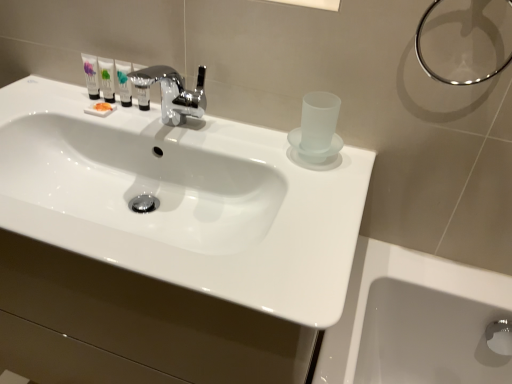
Identify the location of free space on the front side of translucent plastic tube at upper center, which is the 2th mouthwash in right-to-left order. (121, 127).